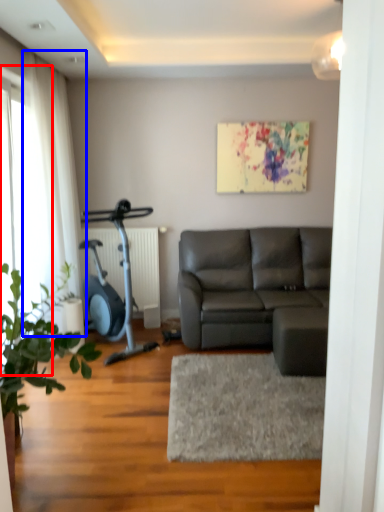
Question: Which object appears farthest to the camera in this image, glass door (highlighted by a red box) or curtain (highlighted by a blue box)?

Choices:
 (A) glass door
 (B) curtain

Answer: (B)